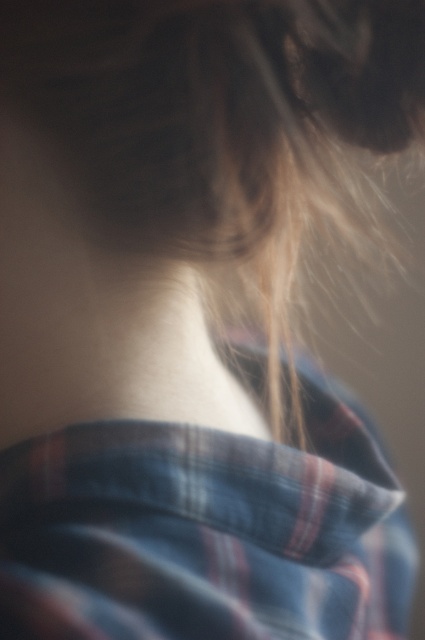
Is plaid cotton shirt at center bigger than skinny white neck at center?

Yes, plaid cotton shirt at center is bigger than skinny white neck at center.

Is plaid cotton shirt at center behind skinny white neck at center?

No, plaid cotton shirt at center is closer to the viewer.

What do you see at coordinates (204, 532) in the screenshot? I see `plaid cotton shirt at center` at bounding box center [204, 532].

Find the location of `plaid cotton shirt at center`. plaid cotton shirt at center is located at coordinates (204, 532).